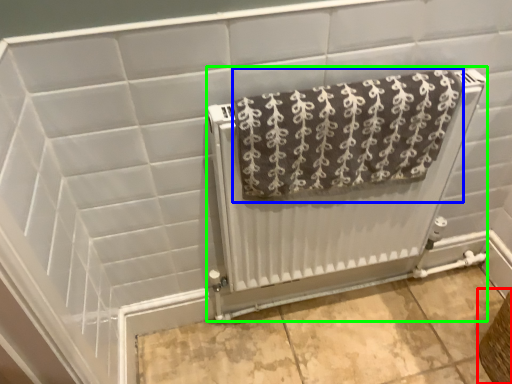
Question: Which object is the farthest from basket (highlighted by a red box)? Choose among these: towel (highlighted by a blue box) or radiator (highlighted by a green box).

Choices:
 (A) towel
 (B) radiator

Answer: (A)